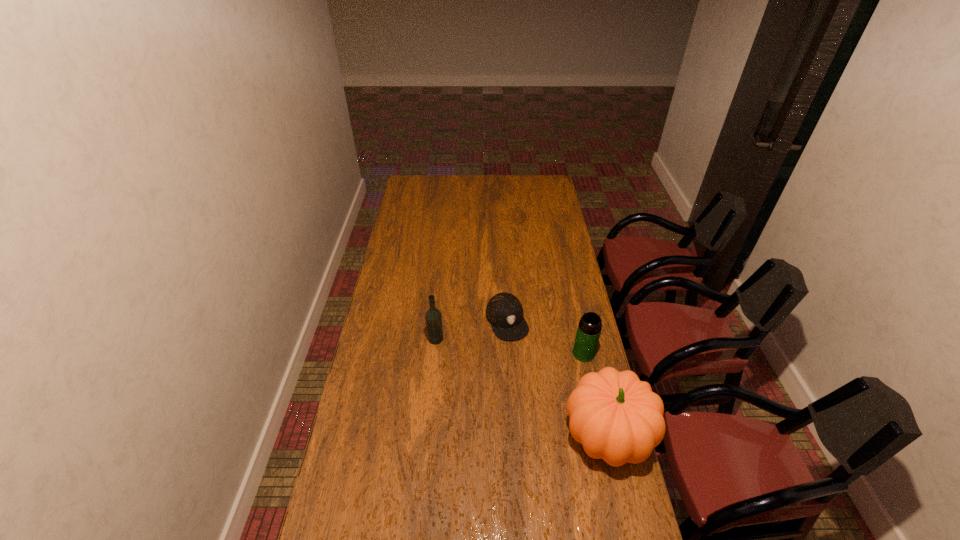
Identify the location of free space in the image that satisfies the following two spatial constraints: 1. on the front side of the pumpkin; 2. on the left side of the thermos bottle. The width and height of the screenshot is (960, 540). (602, 436).

You are a GUI agent. You are given a task and a screenshot of the screen. Output one action in this format:
    pyautogui.click(x=<x>, y=<y>)
    Task: Click on the vacant space that satisfies the following two spatial constraints: 1. on the front side of the thermos bottle; 2. on the left side of the nearest object
    The width and height of the screenshot is (960, 540).
    Given the screenshot: What is the action you would take?
    tap(602, 436)